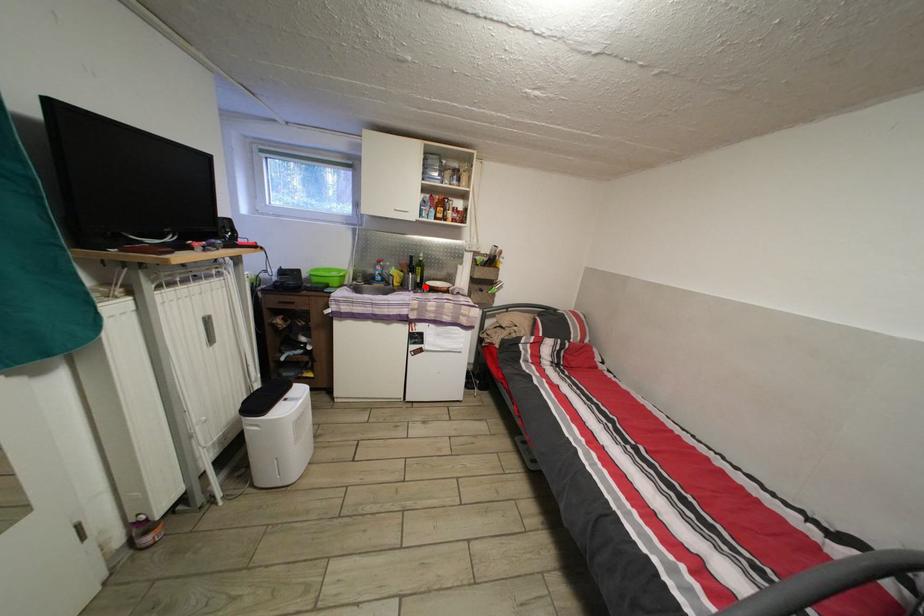
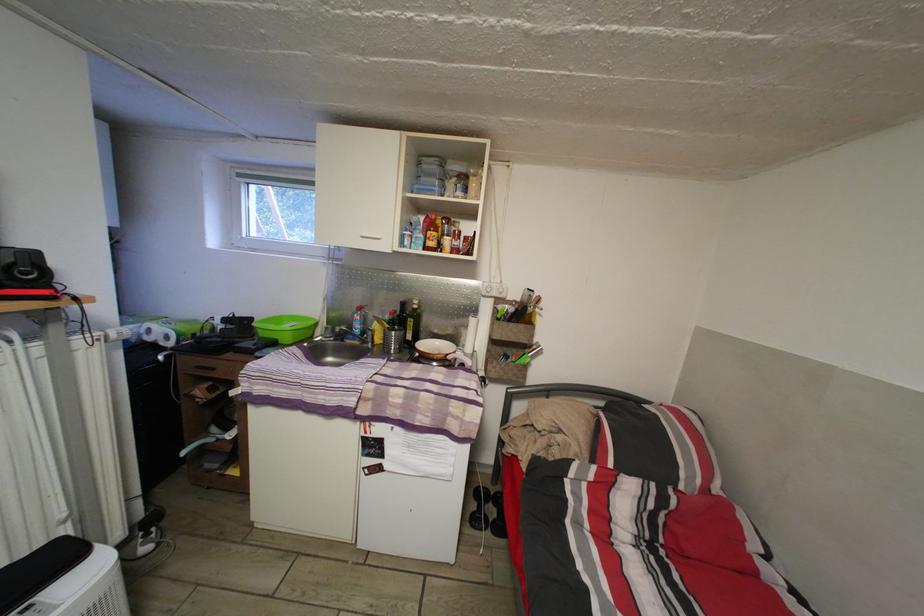
Locate, in the second image, the point that corresponds to the highlighted location in the first image.

(417, 344)